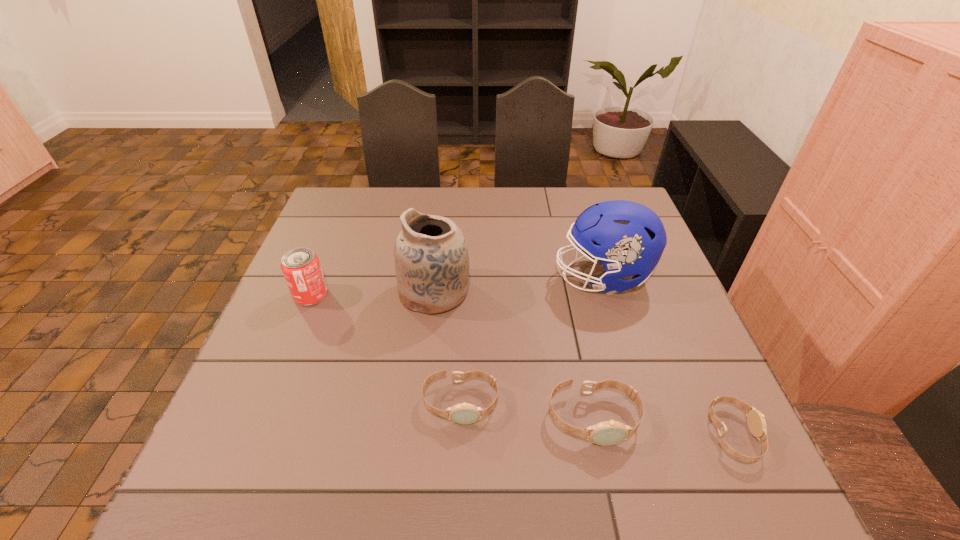
Find the location of `free spot between the shortest object and the leftmost watch`. free spot between the shortest object and the leftmost watch is located at coordinates (597, 418).

Find the location of a particular element. The height and width of the screenshot is (540, 960). unoccupied area between the can and the rightmost watch is located at coordinates (522, 365).

The width and height of the screenshot is (960, 540). Find the location of `vacant region between the football helmet and the pottery`. vacant region between the football helmet and the pottery is located at coordinates (518, 284).

Where is `blank region between the football helmet and the second shortest object`? Image resolution: width=960 pixels, height=540 pixels. blank region between the football helmet and the second shortest object is located at coordinates (532, 339).

This screenshot has height=540, width=960. What are the coordinates of `object that ranks as the third closest to the second watch from left to right` in the screenshot? It's located at (627, 238).

Find the location of a particular element. object that is the nearest to the fourth shortest object is located at coordinates (431, 257).

What are the coordinates of `watch identified as the closest to the fifth tallest object` in the screenshot? It's located at (606, 433).

Where is `watch that stands as the second closest to the football helmet`? Image resolution: width=960 pixels, height=540 pixels. watch that stands as the second closest to the football helmet is located at coordinates (464, 413).

Where is `vacant point that satisfies the following two spatial constraints: 1. on the face guard of the football helmet; 2. on the face of the leftmost watch`? This screenshot has width=960, height=540. vacant point that satisfies the following two spatial constraints: 1. on the face guard of the football helmet; 2. on the face of the leftmost watch is located at coordinates (641, 402).

In order to click on vacant area that satisfies the following two spatial constraints: 1. on the face guard of the football helmet; 2. on the face of the second watch from right to left in this screenshot , I will do `click(646, 418)`.